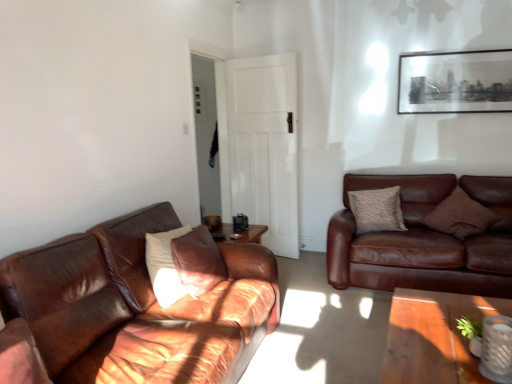
Measure the distance between point (458,208) and camera.

3.62 meters.

Looking at this image, in order to face brown leather couch at right, the second studio couch positioned from the front, should I rotate leftwards or rightwards?

A 21.931 degree turn to the right will do.

What is the approximate width of textured brown pillow at right, which is the 3th pillow in front-to-back order?

It is 9.09 inches.

The height and width of the screenshot is (384, 512). Describe the element at coordinates (455, 82) in the screenshot. I see `black matte picture frame at upper right` at that location.

What are the coordinates of `white matte door at center` in the screenshot? It's located at 264,146.

Does white matte pillow at left, which is the third pillow in right-to-left order, have a lesser width compared to brown leather couch at left, the 2th studio couch in the right-to-left sequence?

Yes, white matte pillow at left, which is the third pillow in right-to-left order, is thinner than brown leather couch at left, the 2th studio couch in the right-to-left sequence.

From the image's perspective, is white matte pillow at left, the 3th pillow in the back-to-front sequence, below brown leather couch at left, the 2th studio couch in the right-to-left sequence?

No, from the image's perspective, white matte pillow at left, the 3th pillow in the back-to-front sequence, is not below brown leather couch at left, the 2th studio couch in the right-to-left sequence.

Considering their positions, is white matte pillow at left, arranged as the first pillow when viewed from the left, located in front of or behind brown leather couch at left, the 1th studio couch positioned from the left?

white matte pillow at left, arranged as the first pillow when viewed from the left, is behind brown leather couch at left, the 1th studio couch positioned from the left.

Considering the relative sizes of white matte pillow at left, arranged as the first pillow when viewed from the left, and black matte picture frame at upper right in the image provided, is white matte pillow at left, arranged as the first pillow when viewed from the left, thinner than black matte picture frame at upper right?

In fact, white matte pillow at left, arranged as the first pillow when viewed from the left, might be wider than black matte picture frame at upper right.

From the image's perspective, is white matte pillow at left, which is the third pillow in right-to-left order, below black matte picture frame at upper right?

Indeed, from the image's perspective, white matte pillow at left, which is the third pillow in right-to-left order, is shown beneath black matte picture frame at upper right.

Is white matte pillow at left, arranged as the first pillow when viewed from the left, spatially inside black matte picture frame at upper right, or outside of it?

white matte pillow at left, arranged as the first pillow when viewed from the left, is not enclosed by black matte picture frame at upper right.

Is white matte door at center in contact with brown textured pillow at right, which ranks as the second pillow in front-to-back order?

white matte door at center and brown textured pillow at right, which ranks as the second pillow in front-to-back order, are not in contact.

Is white matte door at center closer to camera compared to brown textured pillow at right, which is the 3th pillow from left to right?

That is False.

Is white matte door at center outside of brown textured pillow at right, which is the 3th pillow from left to right?

Indeed, white matte door at center is completely outside brown textured pillow at right, which is the 3th pillow from left to right.

Is black matte picture frame at upper right not inside white matte door at center?

Yes, black matte picture frame at upper right is not within white matte door at center.

This screenshot has width=512, height=384. In order to click on glass door that appears below the black matte picture frame at upper right (from a real-world perspective) in this screenshot , I will do `click(264, 146)`.

Between black matte picture frame at upper right and white matte door at center, which one has less height?

Standing shorter between the two is black matte picture frame at upper right.

Which is less distant, (460, 102) or (253, 105)?

The point (460, 102) is closer to the camera.

Is brown leather couch at right, which ranks as the 1th studio couch in back-to-front order, behind black matte picture frame at upper right?

No, the depth of brown leather couch at right, which ranks as the 1th studio couch in back-to-front order, is less than that of black matte picture frame at upper right.

Is brown leather couch at right, the 2th studio couch in the left-to-right sequence, positioned with its back to black matte picture frame at upper right?

brown leather couch at right, the 2th studio couch in the left-to-right sequence, is not turned away from black matte picture frame at upper right.

How distant is brown leather couch at right, the second studio couch positioned from the front, from black matte picture frame at upper right?

The distance of brown leather couch at right, the second studio couch positioned from the front, from black matte picture frame at upper right is 3.48 feet.

Between brown leather couch at right, the second studio couch positioned from the front, and black matte picture frame at upper right, which one has larger width?

Wider between the two is brown leather couch at right, the second studio couch positioned from the front.

Does brown leather couch at right, the 2th studio couch in the left-to-right sequence, contain white matte pillow at left, the 1th pillow when ordered from front to back?

That's incorrect, white matte pillow at left, the 1th pillow when ordered from front to back, is not inside brown leather couch at right, the 2th studio couch in the left-to-right sequence.

Considering the sizes of objects brown leather couch at right, the second studio couch positioned from the front, and white matte pillow at left, the 3th pillow in the back-to-front sequence, in the image provided, who is taller, brown leather couch at right, the second studio couch positioned from the front, or white matte pillow at left, the 3th pillow in the back-to-front sequence,?

Standing taller between the two is brown leather couch at right, the second studio couch positioned from the front.

Does brown leather couch at right, which ranks as the 1th studio couch in back-to-front order, appear on the right side of white matte pillow at left, the 1th pillow when ordered from front to back?

Yes, brown leather couch at right, which ranks as the 1th studio couch in back-to-front order, is to the right of white matte pillow at left, the 1th pillow when ordered from front to back.

Does point (376, 178) lie behind point (195, 252)?

Yes, point (376, 178) is farther from viewer.

The width and height of the screenshot is (512, 384). Identify the location of pillow on the left side of textured brown pillow at right, which is the 3th pillow in front-to-back order. (198, 261).

From the picture: Can you confirm if white matte pillow at left, the 1th pillow when ordered from front to back, is taller than textured brown pillow at right, the 2th pillow in the right-to-left sequence?

Yes.

Choose the correct answer: Is white matte pillow at left, the 1th pillow when ordered from front to back, inside textured brown pillow at right, the 2th pillow in the right-to-left sequence, or outside it?

white matte pillow at left, the 1th pillow when ordered from front to back, is outside textured brown pillow at right, the 2th pillow in the right-to-left sequence.

Based on their sizes in the image, would you say white matte pillow at left, which is the third pillow in right-to-left order, is bigger or smaller than textured brown pillow at right, the 2th pillow in the right-to-left sequence?

Considering their sizes, white matte pillow at left, which is the third pillow in right-to-left order, takes up more space than textured brown pillow at right, the 2th pillow in the right-to-left sequence.

Locate an element on the screen. studio couch in front of the white matte pillow at left, arranged as the first pillow when viewed from the left is located at coordinates (133, 308).

Locate an element on the screen. the 3rd pillow below when counting from the black matte picture frame at upper right (from the image's perspective) is located at coordinates (198, 261).

Estimate the real-world distances between objects in this image. Which object is further from brown leather couch at right, the second studio couch positioned from the front, brown textured pillow at right, the second pillow in the back-to-front sequence, or black matte picture frame at upper right?

black matte picture frame at upper right is further to brown leather couch at right, the second studio couch positioned from the front.

Which object lies further to the anchor point white matte pillow at left, the 1th pillow when ordered from front to back, brown leather couch at right, the second studio couch positioned from the front, or white matte door at center?

white matte door at center.

Based on the photo, based on their spatial positions, is white matte door at center or brown leather couch at right, placed as the 1th studio couch when sorted from right to left, further from textured brown pillow at right, the 2th pillow in the right-to-left sequence?

Based on the image, white matte door at center appears to be further to textured brown pillow at right, the 2th pillow in the right-to-left sequence.

Considering their positions, is white matte pillow at left, the 1th pillow when ordered from front to back, positioned further to brown leather couch at right, placed as the 1th studio couch when sorted from right to left, than textured brown pillow at right, the 2th pillow in the right-to-left sequence?

Based on the image, white matte pillow at left, the 1th pillow when ordered from front to back, appears to be further to brown leather couch at right, placed as the 1th studio couch when sorted from right to left.

When comparing their distances from brown textured pillow at right, the second pillow in the back-to-front sequence, does brown leather couch at left, the 2th studio couch in the right-to-left sequence, or textured brown pillow at right, the 2th pillow in the right-to-left sequence, seem closer?

Among the two, textured brown pillow at right, the 2th pillow in the right-to-left sequence, is located nearer to brown textured pillow at right, the second pillow in the back-to-front sequence.

Which object lies further to the anchor point white matte pillow at left, the 1th pillow when ordered from front to back, black matte picture frame at upper right or textured brown pillow at right, which is the 1th pillow from back to front?

The object further to white matte pillow at left, the 1th pillow when ordered from front to back, is black matte picture frame at upper right.

When comparing their distances from brown leather couch at right, the 2th studio couch in the left-to-right sequence, does black matte picture frame at upper right or white matte pillow at left, the 1th pillow when ordered from front to back, seem closer?

Among the two, black matte picture frame at upper right is located nearer to brown leather couch at right, the 2th studio couch in the left-to-right sequence.

When comparing their distances from white matte door at center, does brown leather couch at right, the 2th studio couch in the left-to-right sequence, or brown textured pillow at right, which ranks as the second pillow in front-to-back order, seem further?

brown textured pillow at right, which ranks as the second pillow in front-to-back order.

Identify the location of studio couch between white matte door at center and black matte picture frame at upper right from left to right. The width and height of the screenshot is (512, 384). (424, 240).

This screenshot has width=512, height=384. In order to click on pillow between white matte door at center and brown textured pillow at right, which ranks as the second pillow in front-to-back order, from left to right in this screenshot , I will do `click(377, 210)`.

What are the coordinates of `pillow between brown leather couch at right, the second studio couch positioned from the front, and textured brown pillow at right, which is the 3th pillow in front-to-back order, from front to back` in the screenshot? It's located at (460, 215).

Find the location of a particular element. The image size is (512, 384). studio couch between white matte pillow at left, the 3th pillow in the back-to-front sequence, and brown textured pillow at right, which is the 3th pillow from left to right, from left to right is located at coordinates (424, 240).